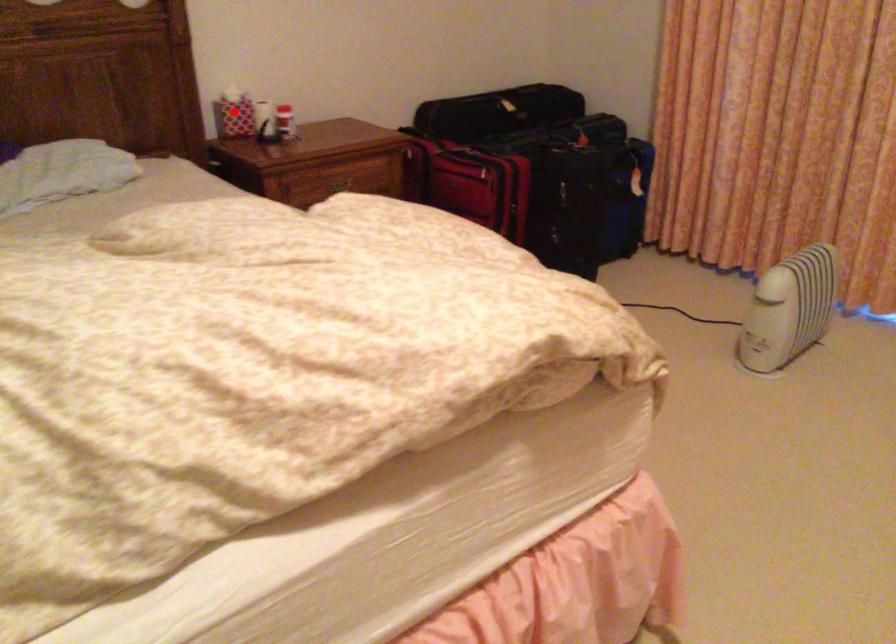
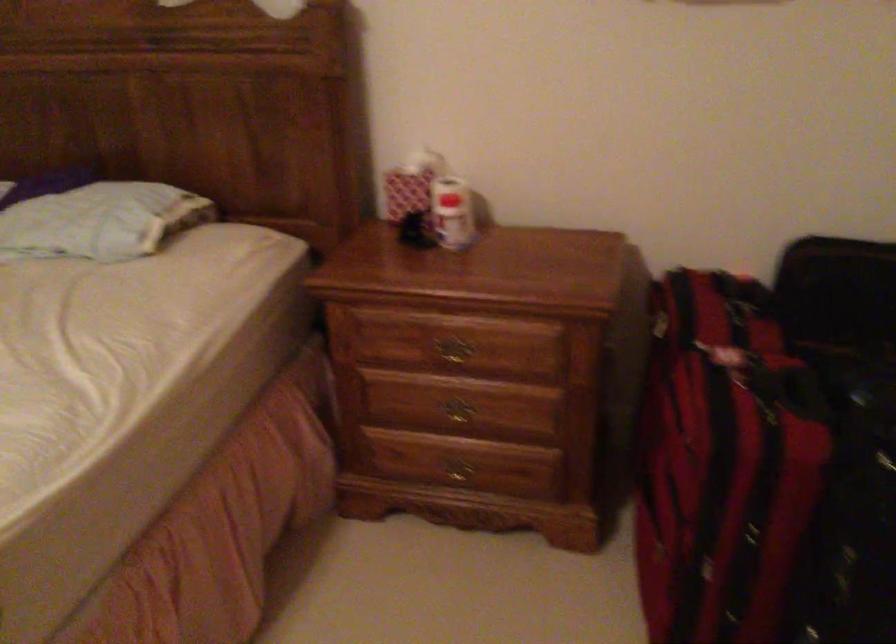
Find the pixel in the second image that matches the highlighted location in the first image.

(410, 184)